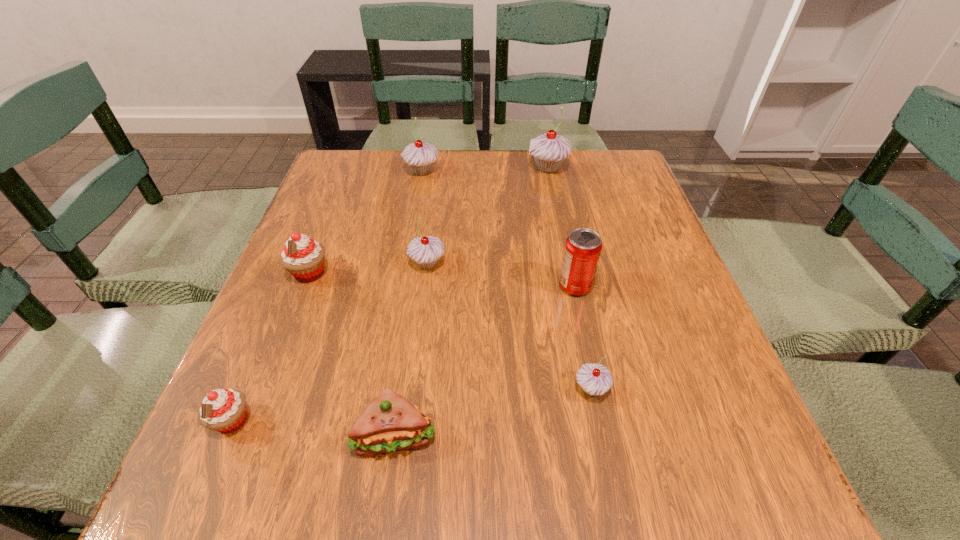
Identify the location of blank space located 0.290m on the right of the second biggest gray cupcake. The width and height of the screenshot is (960, 540). (544, 172).

Locate an element on the screen. blank space located 0.210m on the left of the red soda can is located at coordinates 457,286.

At what (x,y) coordinates should I click in order to perform the action: click on free location located on the right of the second nearest gray cupcake. Please return your answer as a coordinate pair (x, y). The width and height of the screenshot is (960, 540). Looking at the image, I should click on (473, 264).

At what (x,y) coordinates should I click in order to perform the action: click on free space located on the right of the farther pink cupcake. Please return your answer as a coordinate pair (x, y). This screenshot has height=540, width=960. Looking at the image, I should click on (392, 273).

Where is `vacant space located 0.220m on the left of the sandwich`? The image size is (960, 540). vacant space located 0.220m on the left of the sandwich is located at coordinates (211, 435).

Find the location of a particular element. The image size is (960, 540). free space located 0.080m on the left of the smallest gray cupcake is located at coordinates (526, 389).

This screenshot has width=960, height=540. Identify the location of free space located on the back of the nearer pink cupcake. (261, 352).

Find the location of a particular element. This screenshot has width=960, height=540. object that is at the near edge is located at coordinates (390, 422).

At what (x,y) coordinates should I click in order to perform the action: click on free space at the far edge. Please return your answer as a coordinate pair (x, y). Looking at the image, I should click on (568, 158).

This screenshot has width=960, height=540. I want to click on free space at the left edge of the desktop, so click(x=309, y=289).